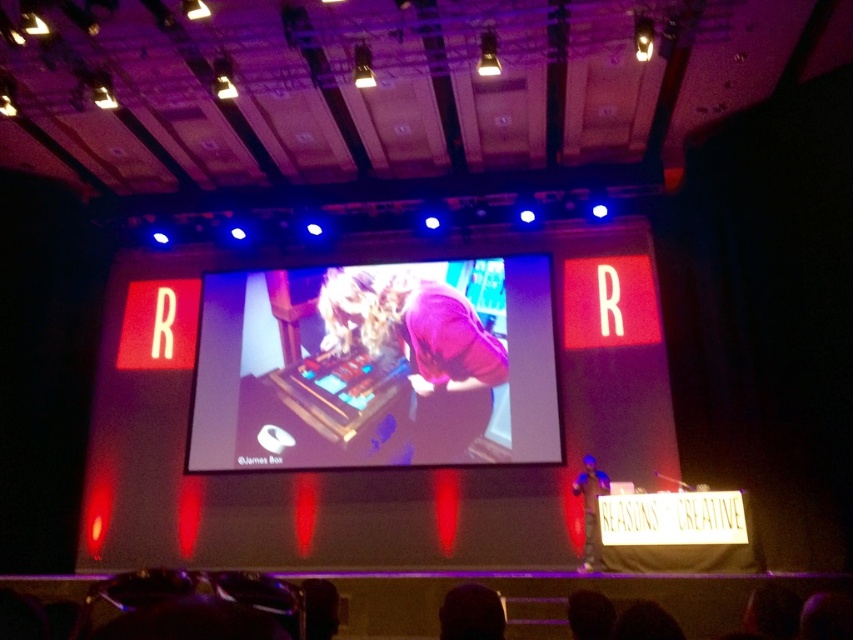
Is metallic silver keyboard at center thinner than matte pink shirt at center?

Incorrect, metallic silver keyboard at center's width is not less than matte pink shirt at center's.

Between point (386, 460) and point (595, 570), which one is positioned behind?

Point (386, 460)

This screenshot has height=640, width=853. Find the location of `metallic silver keyboard at center`. metallic silver keyboard at center is located at coordinates (376, 365).

Is dark hair at lower center further to camera compared to matte pink shirt at center?

No, it is in front of matte pink shirt at center.

The image size is (853, 640). I want to click on dark hair at lower center, so click(471, 612).

Can you confirm if metallic silver keyboard at center is positioned to the right of purple matte shirt at center?

In fact, metallic silver keyboard at center is to the left of purple matte shirt at center.

Is point (479, 396) closer to viewer compared to point (489, 342)?

That is True.

This screenshot has height=640, width=853. I want to click on metallic silver keyboard at center, so click(376, 365).